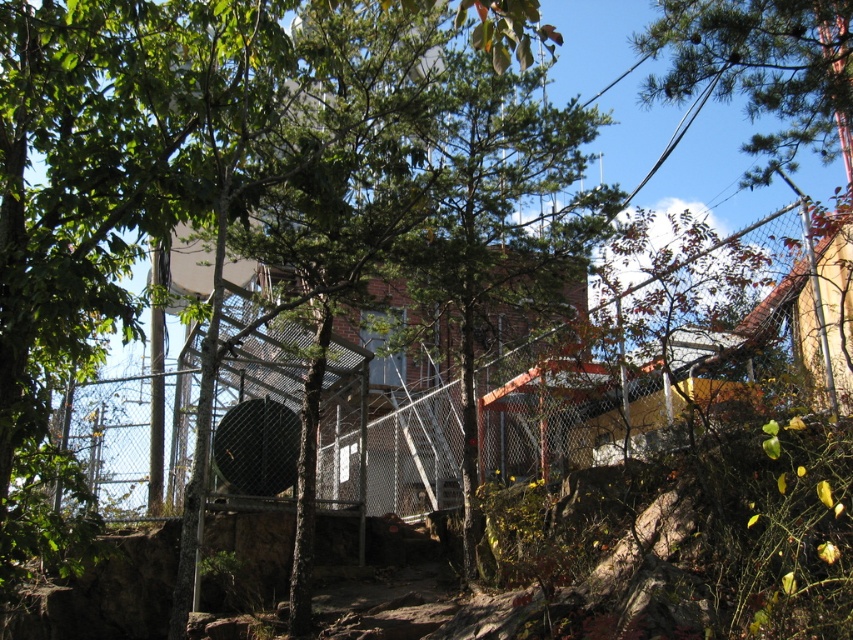
From the picture: Who is positioned more to the right, green leafy tree at center or metal chain-link fence at center?

From the viewer's perspective, metal chain-link fence at center appears more on the right side.

Who is taller, green leafy tree at center or metal chain-link fence at center?

green leafy tree at center is taller.

Does point (85, 280) come closer to viewer compared to point (321, 406)?

Yes, point (85, 280) is in front of point (321, 406).

I want to click on green leafy tree at center, so click(x=128, y=170).

Which is more to the right, metal chain-link fence at center or green pine tree at upper right?

green pine tree at upper right

Can you confirm if metal chain-link fence at center is positioned above green pine tree at upper right?

Actually, metal chain-link fence at center is below green pine tree at upper right.

At what (x,y) coordinates should I click in order to perform the action: click on metal chain-link fence at center. Please return your answer as a coordinate pair (x, y). The height and width of the screenshot is (640, 853). Looking at the image, I should click on (631, 385).

Between green pine tree at upper right and black matte basketball hoop at center, which one appears on the left side from the viewer's perspective?

black matte basketball hoop at center is more to the left.

Does point (654, 93) come closer to viewer compared to point (257, 449)?

Yes, point (654, 93) is in front of point (257, 449).

The image size is (853, 640). What are the coordinates of `green pine tree at upper right` in the screenshot? It's located at (764, 68).